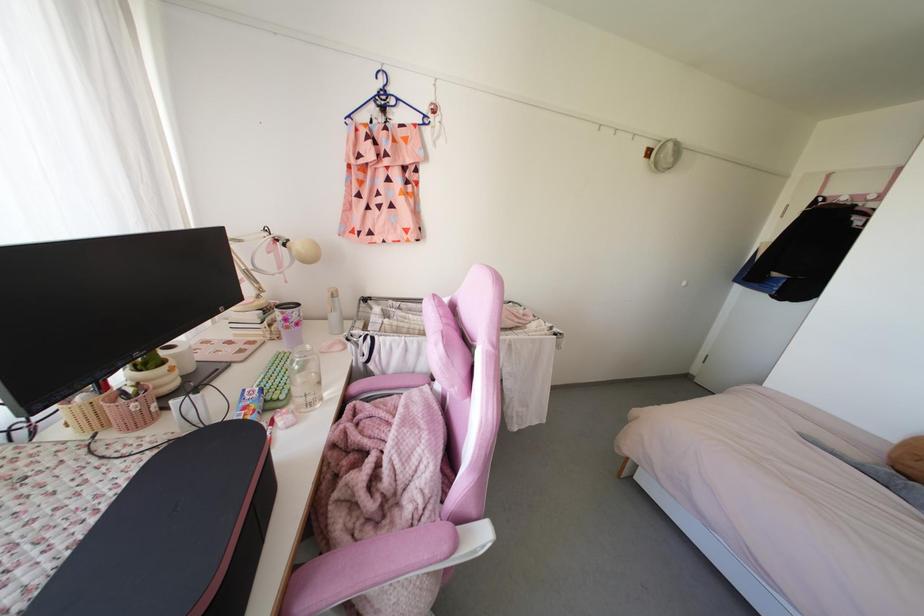
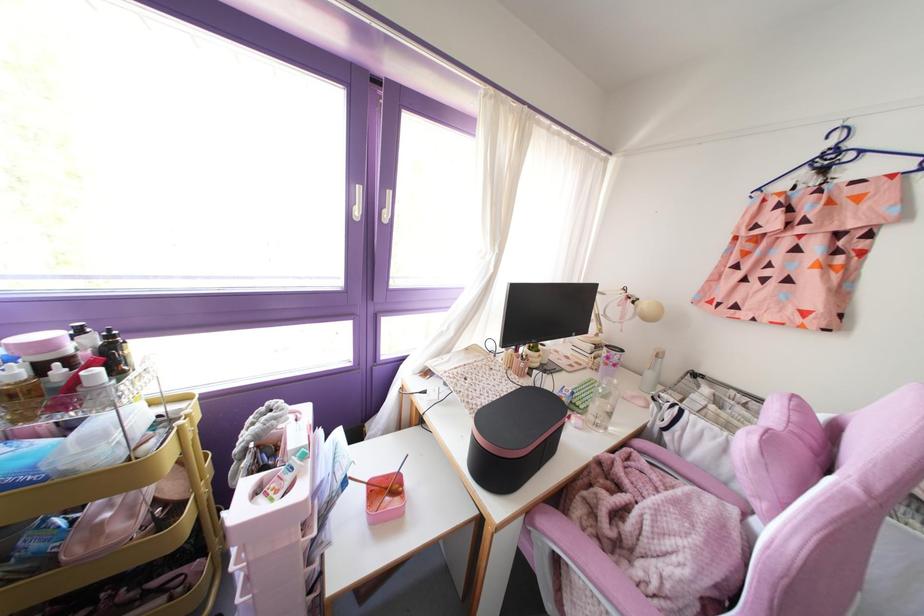
The point at [296,323] is marked in the first image. Where is the corresponding point in the second image?

(614, 365)